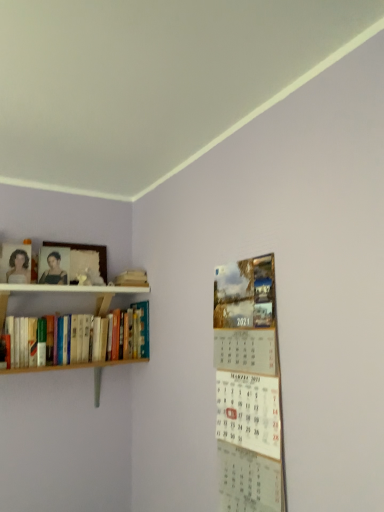
Identify the location of wooden books at left. This screenshot has height=512, width=384. (81, 340).

What is the approximate width of wooden photo frame at upper left?

wooden photo frame at upper left is 1.28 inches in width.

Measure the distance between metallic silver calendar at right and camera.

3.80 feet.

What is the approximate width of metallic silver calendar at right?

The width of metallic silver calendar at right is 1.28 inches.

I want to click on matte black portrait at upper left, which is counted as the first person, starting from the right, so click(54, 271).

This screenshot has height=512, width=384. Find the location of `matte white portrait at left, acting as the 2th person starting from the right`. matte white portrait at left, acting as the 2th person starting from the right is located at coordinates (18, 267).

Is matte white portrait at left, acting as the 2th person starting from the right, positioned beyond the bounds of wooden books at left?

Yes.

Who is taller, matte white portrait at left, the 1th person when ordered from left to right, or wooden books at left?

wooden books at left is taller.

Consider the image. Is matte white portrait at left, the 1th person when ordered from left to right, at the left side of wooden books at left?

Indeed, matte white portrait at left, the 1th person when ordered from left to right, is positioned on the left side of wooden books at left.

Is matte white portrait at left, the 1th person when ordered from left to right, further to the viewer compared to wooden books at left?

That is True.

What's the angular difference between metallic silver calendar at right and wooden photo frame at upper left's facing directions?

metallic silver calendar at right and wooden photo frame at upper left are facing 90 degrees away from each other.

In terms of width, does metallic silver calendar at right look wider or thinner when compared to wooden photo frame at upper left?

Considering their sizes, metallic silver calendar at right looks slimmer than wooden photo frame at upper left.

At what (x,y) coordinates should I click in order to perform the action: click on picture frame on the left of metallic silver calendar at right. Please return your answer as a coordinate pair (x, y). Looking at the image, I should click on (87, 250).

Is point (213, 323) closer to viewer compared to point (53, 246)?

Yes, it is.

Does matte black portrait at upper left, the second person viewed from the left, have a greater width compared to wooden books at left?

No.

Based on the photo, based on their positions, is matte black portrait at upper left, the second person viewed from the left, located to the left or right of wooden books at left?

matte black portrait at upper left, the second person viewed from the left, is to the left of wooden books at left.

Does matte black portrait at upper left, the second person viewed from the left, have a smaller size compared to wooden books at left?

Correct, matte black portrait at upper left, the second person viewed from the left, occupies less space than wooden books at left.

Relative to wooden books at left, is matte black portrait at upper left, the second person viewed from the left, in front or behind?

Visually, matte black portrait at upper left, the second person viewed from the left, is located behind wooden books at left.

Looking at this image, is the depth of wooden books at left less than that of matte white portrait at left, the 1th person when ordered from left to right?

Yes, it is in front of matte white portrait at left, the 1th person when ordered from left to right.

Is wooden books at left facing away from matte white portrait at left, acting as the 2th person starting from the right?

That's not correct — wooden books at left is not looking away from matte white portrait at left, acting as the 2th person starting from the right.

Considering the relative sizes of wooden books at left and matte white portrait at left, acting as the 2th person starting from the right, in the image provided, is wooden books at left thinner than matte white portrait at left, acting as the 2th person starting from the right,?

Incorrect, the width of wooden books at left is not less than that of matte white portrait at left, acting as the 2th person starting from the right.

Is wooden books at left not inside matte white portrait at left, acting as the 2th person starting from the right?

Yes, wooden books at left is located beyond the bounds of matte white portrait at left, acting as the 2th person starting from the right.

From the picture: Is metallic silver calendar at right looking in the opposite direction of matte white portrait at left, acting as the 2th person starting from the right?

No, matte white portrait at left, acting as the 2th person starting from the right, is not at the back of metallic silver calendar at right.

Considering the sizes of objects metallic silver calendar at right and matte white portrait at left, acting as the 2th person starting from the right, in the image provided, who is wider, metallic silver calendar at right or matte white portrait at left, acting as the 2th person starting from the right,?

matte white portrait at left, acting as the 2th person starting from the right, is wider.

From the picture: Is metallic silver calendar at right at the left side of matte white portrait at left, the 1th person when ordered from left to right?

Incorrect, metallic silver calendar at right is not on the left side of matte white portrait at left, the 1th person when ordered from left to right.

Considering the positions of objects metallic silver calendar at right and matte white portrait at left, acting as the 2th person starting from the right, in the image provided, who is in front, metallic silver calendar at right or matte white portrait at left, acting as the 2th person starting from the right,?

Positioned in front is metallic silver calendar at right.

From a real-world perspective, is metallic silver calendar at right positioned above or below wooden books at left?

metallic silver calendar at right is below wooden books at left.

Is metallic silver calendar at right far away from wooden books at left?

No, metallic silver calendar at right is not far away from wooden books at left.

Considering the relative sizes of metallic silver calendar at right and wooden books at left in the image provided, is metallic silver calendar at right shorter than wooden books at left?

Incorrect, the height of metallic silver calendar at right does not fall short of that of wooden books at left.

Is wooden books at left facing away from metallic silver calendar at right?

No, wooden books at left is not facing away from metallic silver calendar at right.

Where is `book behind the metallic silver calendar at right`? book behind the metallic silver calendar at right is located at coordinates coord(81,340).

From the image's perspective, does wooden books at left appear lower than metallic silver calendar at right?

Actually, wooden books at left appears above metallic silver calendar at right in the image.

In the scene shown: Is wooden books at left next to metallic silver calendar at right and touching it?

wooden books at left is not next to metallic silver calendar at right, and they're not touching.

The image size is (384, 512). Find the location of `book to the right of matte white portrait at left, acting as the 2th person starting from the right`. book to the right of matte white portrait at left, acting as the 2th person starting from the right is located at coordinates (81, 340).

This screenshot has height=512, width=384. I want to click on picture frame located on the left of metallic silver calendar at right, so click(87, 250).

Considering their positions, is wooden books at left positioned further to wooden photo frame at upper left than metallic silver calendar at right?

metallic silver calendar at right lies further to wooden photo frame at upper left than the other object.

When comparing their distances from matte black portrait at upper left, the second person viewed from the left, does matte white portrait at left, acting as the 2th person starting from the right, or metallic silver calendar at right seem closer?

Based on the image, matte white portrait at left, acting as the 2th person starting from the right, appears to be nearer to matte black portrait at upper left, the second person viewed from the left.

Considering their positions, is metallic silver calendar at right positioned further to wooden books at left than wooden photo frame at upper left?

metallic silver calendar at right.

Looking at the image, which one is located closer to wooden books at left, wooden photo frame at upper left or metallic silver calendar at right?

wooden photo frame at upper left is positioned closer to the anchor wooden books at left.

From the image, which object appears to be nearer to matte white portrait at left, the 1th person when ordered from left to right, matte black portrait at upper left, the second person viewed from the left, or wooden books at left?

Based on the image, matte black portrait at upper left, the second person viewed from the left, appears to be nearer to matte white portrait at left, the 1th person when ordered from left to right.

Based on their spatial positions, is wooden photo frame at upper left or wooden books at left closer to matte white portrait at left, acting as the 2th person starting from the right?

Among the two, wooden photo frame at upper left is located nearer to matte white portrait at left, acting as the 2th person starting from the right.

Considering their positions, is metallic silver calendar at right positioned further to matte black portrait at upper left, the second person viewed from the left, than wooden books at left?

metallic silver calendar at right.

Which object lies further to the anchor point matte black portrait at upper left, which is counted as the first person, starting from the right, wooden photo frame at upper left or wooden books at left?

wooden books at left.

This screenshot has width=384, height=512. I want to click on picture frame between matte white portrait at left, the 1th person when ordered from left to right, and metallic silver calendar at right, in the horizontal direction, so click(x=87, y=250).

The image size is (384, 512). Find the location of `person between wooden photo frame at upper left and wooden books at left vertically`. person between wooden photo frame at upper left and wooden books at left vertically is located at coordinates (54, 271).

Where is `person that lies between matte white portrait at left, acting as the 2th person starting from the right, and wooden books at left from top to bottom`? The image size is (384, 512). person that lies between matte white portrait at left, acting as the 2th person starting from the right, and wooden books at left from top to bottom is located at coordinates (54, 271).

Find the location of a particular element. This screenshot has height=512, width=384. picture frame between matte white portrait at left, the 1th person when ordered from left to right, and wooden books at left in the up-down direction is located at coordinates (87, 250).